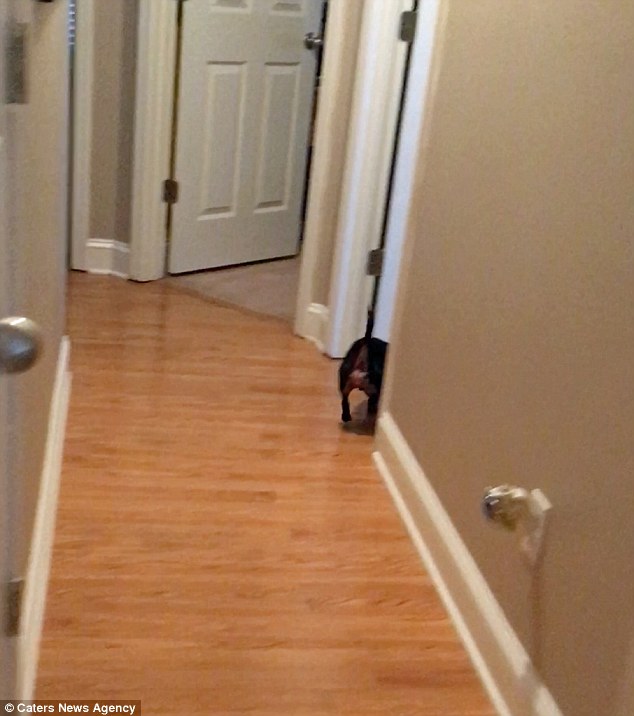
Image resolution: width=634 pixels, height=716 pixels. What are the coordinates of `wood floor` in the screenshot? It's located at pos(276,553).